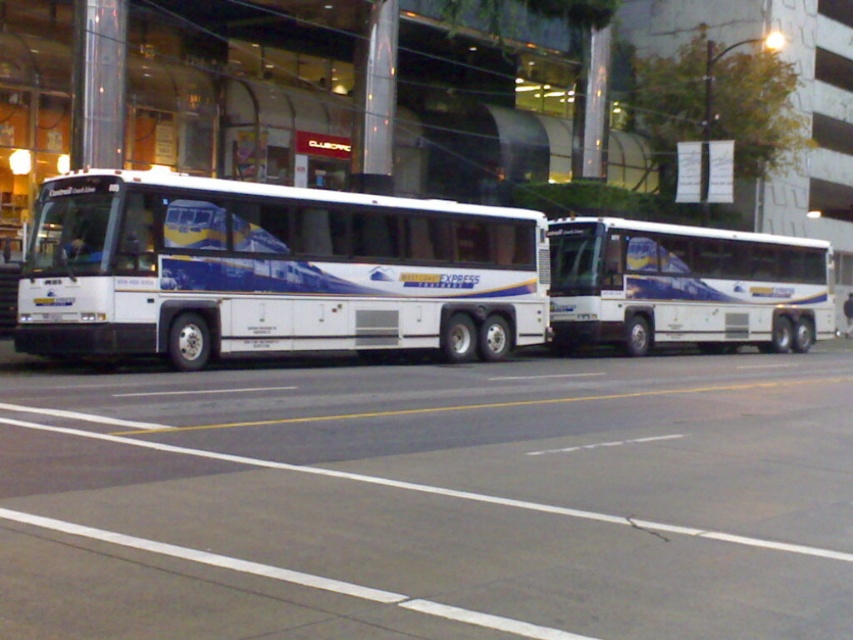
Question: Does white glossy bus at left appear on the left side of white glossy bus at center?

Choices:
 (A) no
 (B) yes

Answer: (B)

Question: Which of the following is the farthest from the observer?

Choices:
 (A) white glossy bus at center
 (B) dark blue fabric couple at center
 (C) white glossy bus at left

Answer: (B)

Question: Which point is farther from the camera taking this photo?

Choices:
 (A) (820, 298)
 (B) (848, 328)

Answer: (B)

Question: Where is white glossy bus at center located in relation to dark blue fabric couple at center in the image?

Choices:
 (A) left
 (B) right

Answer: (A)

Question: Which object appears farthest from the camera in this image?

Choices:
 (A) white glossy bus at left
 (B) dark blue fabric couple at center

Answer: (B)

Question: Observing the image, what is the correct spatial positioning of white glossy bus at left in reference to dark blue fabric couple at center?

Choices:
 (A) above
 (B) below

Answer: (A)